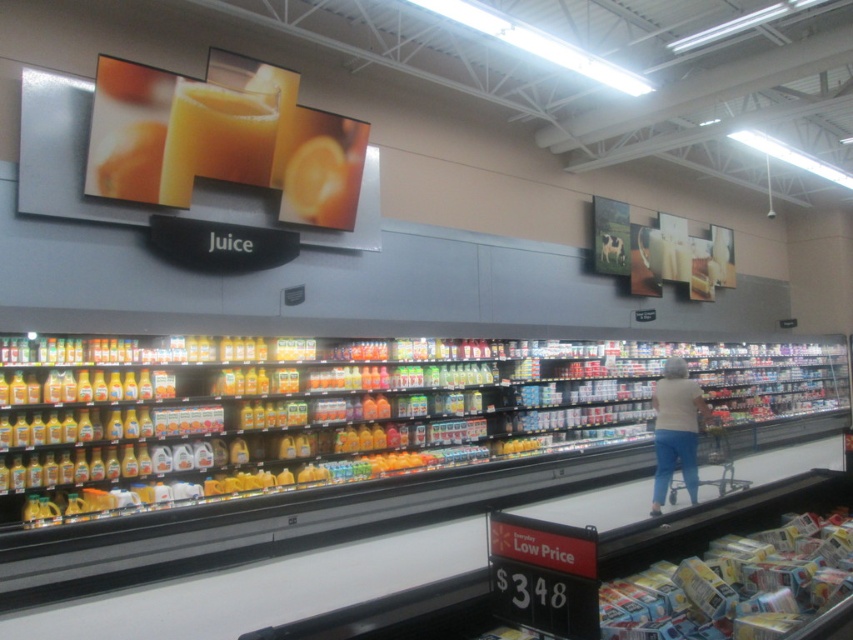
Can you confirm if smooth orange juice at upper center is smaller than white cotton shirt at center?

Actually, smooth orange juice at upper center might be larger than white cotton shirt at center.

Measure the distance between smooth orange juice at upper center and white cotton shirt at center.

A distance of 5.42 meters exists between smooth orange juice at upper center and white cotton shirt at center.

Locate an element on the screen. The width and height of the screenshot is (853, 640). smooth orange juice at upper center is located at coordinates (216, 138).

Image resolution: width=853 pixels, height=640 pixels. Identify the location of smooth orange juice at upper center. (216, 138).